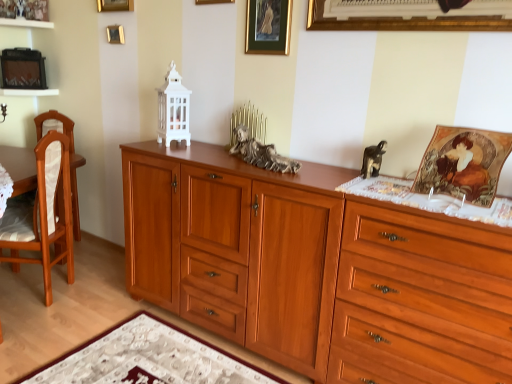
Question: Should I look upward or downward to see gold-framed picture at upper center, which ranks as the fourth picture frame in top-to-bottom order?

Choices:
 (A) down
 (B) up

Answer: (B)

Question: From a real-world perspective, is gold-framed picture at upper center, positioned as the second picture frame in right-to-left order, under light brown wood chair at left?

Choices:
 (A) yes
 (B) no

Answer: (B)

Question: From a real-world perspective, is gold-framed picture at upper center, placed as the fourth picture frame when sorted from back to front, on light brown wood chair at left?

Choices:
 (A) yes
 (B) no

Answer: (A)

Question: Is gold-framed picture at upper center, which appears as the second picture frame when ordered from the bottom, at the left side of light brown wood chair at left?

Choices:
 (A) no
 (B) yes

Answer: (A)

Question: Is gold-framed picture at upper center, placed as the fourth picture frame when sorted from back to front, facing towards light brown wood chair at left?

Choices:
 (A) yes
 (B) no

Answer: (B)

Question: Can you confirm if gold-framed picture at upper center, placed as the fourth picture frame when sorted from back to front, is wider than light brown wood chair at left?

Choices:
 (A) yes
 (B) no

Answer: (B)

Question: Is gold-framed picture at upper center, positioned as the second picture frame in right-to-left order, thinner than light brown wood chair at left?

Choices:
 (A) no
 (B) yes

Answer: (B)

Question: Is wooden cabinet at center positioned before gold metallic picture frame at upper center, placed as the fifth picture frame when sorted from bottom to top?

Choices:
 (A) yes
 (B) no

Answer: (A)

Question: Is gold metallic picture frame at upper center, placed as the fifth picture frame when sorted from bottom to top, located within wooden cabinet at center?

Choices:
 (A) yes
 (B) no

Answer: (B)

Question: Is wooden cabinet at center at the left side of gold metallic picture frame at upper center, the 2th picture frame when ordered from left to right?

Choices:
 (A) yes
 (B) no

Answer: (B)

Question: Considering the relative sizes of wooden cabinet at center and gold metallic picture frame at upper center, which ranks as the 4th picture frame in front-to-back order, in the image provided, is wooden cabinet at center thinner than gold metallic picture frame at upper center, which ranks as the 4th picture frame in front-to-back order,?

Choices:
 (A) no
 (B) yes

Answer: (A)

Question: Could you tell me if wooden cabinet at center is facing gold metallic picture frame at upper center, the 2th picture frame when ordered from left to right?

Choices:
 (A) no
 (B) yes

Answer: (A)

Question: From the image's perspective, is wooden cabinet at center located above gold metallic picture frame at upper center, which ranks as the 4th picture frame in front-to-back order?

Choices:
 (A) no
 (B) yes

Answer: (A)

Question: Is wooden cabinet at center positioned beyond the bounds of white textured mat at lower center?

Choices:
 (A) yes
 (B) no

Answer: (A)